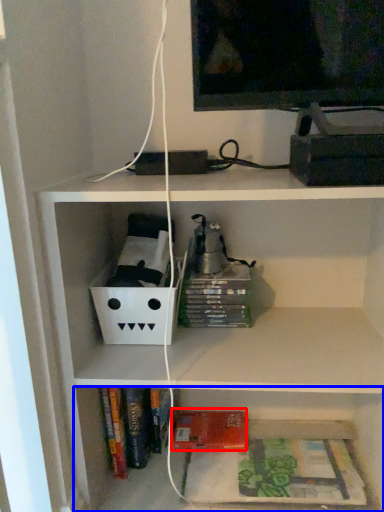
Question: Which object appears farthest to the camera in this image, paperback book (highlighted by a red box) or shelf (highlighted by a blue box)?

Choices:
 (A) paperback book
 (B) shelf

Answer: (A)